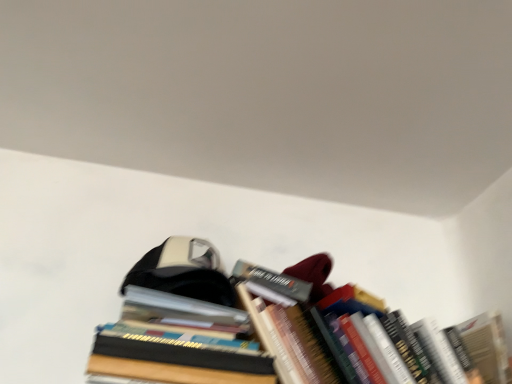
Question: From the image's perspective, is hardcover books at upper right, positioned as the first book in right-to-left order, located beneath hardcover books at center, positioned as the first book in left-to-right order?

Choices:
 (A) yes
 (B) no

Answer: (A)

Question: Are hardcover books at upper right, the second book from the left, and hardcover books at center, positioned as the first book in left-to-right order, far apart?

Choices:
 (A) no
 (B) yes

Answer: (A)

Question: Could hardcover books at center, positioned as the first book in left-to-right order, be considered to be inside hardcover books at upper right, positioned as the first book in right-to-left order?

Choices:
 (A) yes
 (B) no

Answer: (B)

Question: Considering the relative positions of hardcover books at upper right, positioned as the first book in right-to-left order, and hardcover books at center, placed as the 2th book when sorted from right to left, in the image provided, is hardcover books at upper right, positioned as the first book in right-to-left order, behind hardcover books at center, placed as the 2th book when sorted from right to left,?

Choices:
 (A) no
 (B) yes

Answer: (B)

Question: Can you confirm if hardcover books at upper right, positioned as the first book in right-to-left order, is taller than hardcover books at center, positioned as the first book in left-to-right order?

Choices:
 (A) yes
 (B) no

Answer: (A)

Question: Can you confirm if hardcover books at upper right, positioned as the first book in right-to-left order, is thinner than hardcover books at center, positioned as the first book in left-to-right order?

Choices:
 (A) yes
 (B) no

Answer: (B)

Question: Considering the relative sizes of hardcover books at center, positioned as the first book in left-to-right order, and hardcover books at upper right, the second book from the left, in the image provided, is hardcover books at center, positioned as the first book in left-to-right order, smaller than hardcover books at upper right, the second book from the left,?

Choices:
 (A) no
 (B) yes

Answer: (B)

Question: From a real-world perspective, is hardcover books at center, positioned as the first book in left-to-right order, located higher than hardcover books at upper right, the second book from the left?

Choices:
 (A) no
 (B) yes

Answer: (A)

Question: Can hardcover books at upper right, positioned as the first book in right-to-left order, be found inside hardcover books at center, placed as the 2th book when sorted from right to left?

Choices:
 (A) yes
 (B) no

Answer: (B)

Question: Considering the relative positions of hardcover books at center, placed as the 2th book when sorted from right to left, and hardcover books at upper right, positioned as the first book in right-to-left order, in the image provided, is hardcover books at center, placed as the 2th book when sorted from right to left, in front of hardcover books at upper right, positioned as the first book in right-to-left order,?

Choices:
 (A) yes
 (B) no

Answer: (A)

Question: Is the depth of hardcover books at center, positioned as the first book in left-to-right order, greater than that of hardcover books at upper right, the second book from the left?

Choices:
 (A) no
 (B) yes

Answer: (A)

Question: Is hardcover books at center, positioned as the first book in left-to-right order, thinner than hardcover books at upper right, the second book from the left?

Choices:
 (A) no
 (B) yes

Answer: (B)

Question: Is hardcover books at center, positioned as the first book in left-to-right order, bigger or smaller than hardcover books at upper right, the second book from the left?

Choices:
 (A) small
 (B) big

Answer: (A)